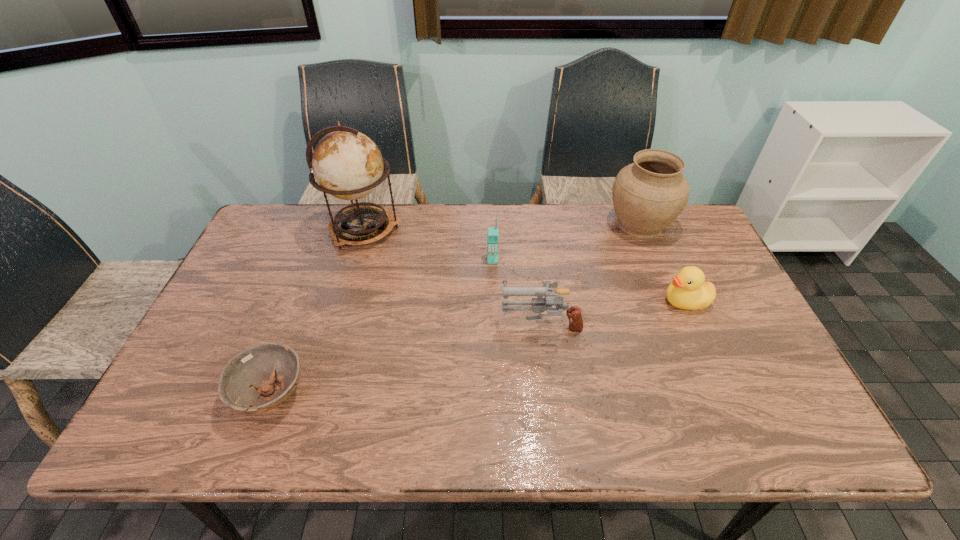
Locate an element on the screen. This screenshot has width=960, height=540. vacant space at the far left corner is located at coordinates (264, 237).

Image resolution: width=960 pixels, height=540 pixels. What are the coordinates of `vacant space at the near left corner of the desktop` in the screenshot? It's located at (203, 410).

The image size is (960, 540). Identify the location of unoccupied position between the fifth shortest object and the duck. (662, 262).

The image size is (960, 540). What are the coordinates of `empty location between the third object from left to right and the globe` in the screenshot? It's located at (428, 245).

Locate an element on the screen. Image resolution: width=960 pixels, height=540 pixels. free space that is in between the tallest object and the gun is located at coordinates (452, 276).

Identify the location of free spot between the duck and the nearest object. (478, 348).

Where is `vacant space that's between the nearest object and the gun`? vacant space that's between the nearest object and the gun is located at coordinates (406, 359).

At what (x,y) coordinates should I click in order to perform the action: click on free point between the duck and the shortest object. Please return your answer as a coordinate pair (x, y). This screenshot has width=960, height=540. Looking at the image, I should click on click(x=478, y=348).

In order to click on free space between the gun and the second tallest object in this screenshot , I will do `click(590, 274)`.

You are a GUI agent. You are given a task and a screenshot of the screen. Output one action in this format:
    pyautogui.click(x=<x>, y=<y>)
    Task: Click on the vacant space in between the second tallest object and the second shortest object
    Image resolution: width=960 pixels, height=540 pixels.
    Given the screenshot: What is the action you would take?
    pyautogui.click(x=662, y=262)